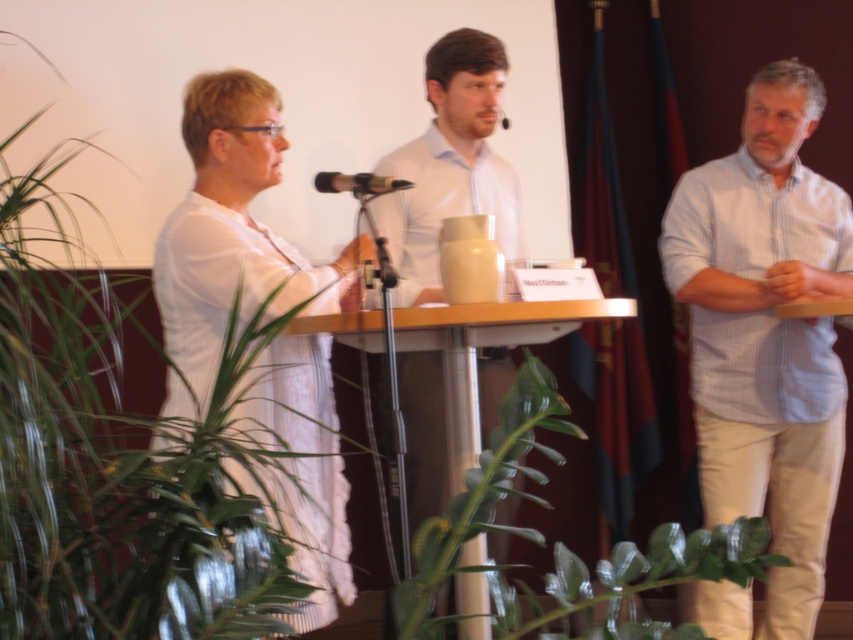
Is white striped shirt at right shorter than black plastic microphone at center?

No.

Can you confirm if white striped shirt at right is positioned to the left of black plastic microphone at center?

In fact, white striped shirt at right is to the right of black plastic microphone at center.

At what (x,y) coordinates should I click in order to perform the action: click on white striped shirt at right. Please return your answer as a coordinate pair (x, y). Looking at the image, I should click on (766, 332).

Locate an element on the screen. This screenshot has height=640, width=853. white striped shirt at right is located at coordinates (766, 332).

Does green leafy plant at left have a larger size compared to black plastic microphone at center?

Yes.

Does green leafy plant at left have a smaller size compared to black plastic microphone at center?

No.

Is point (53, 364) behind point (503, 116)?

No, (53, 364) is in front of (503, 116).

Locate an element on the screen. The image size is (853, 640). green leafy plant at left is located at coordinates (167, 438).

Which is above, white striped shirt at right or green glossy leaf at lower center?

Positioned higher is white striped shirt at right.

Between point (814, 417) and point (683, 637), which one is positioned behind?

Positioned behind is point (814, 417).

Where is `white striped shirt at right`? The image size is (853, 640). white striped shirt at right is located at coordinates (766, 332).